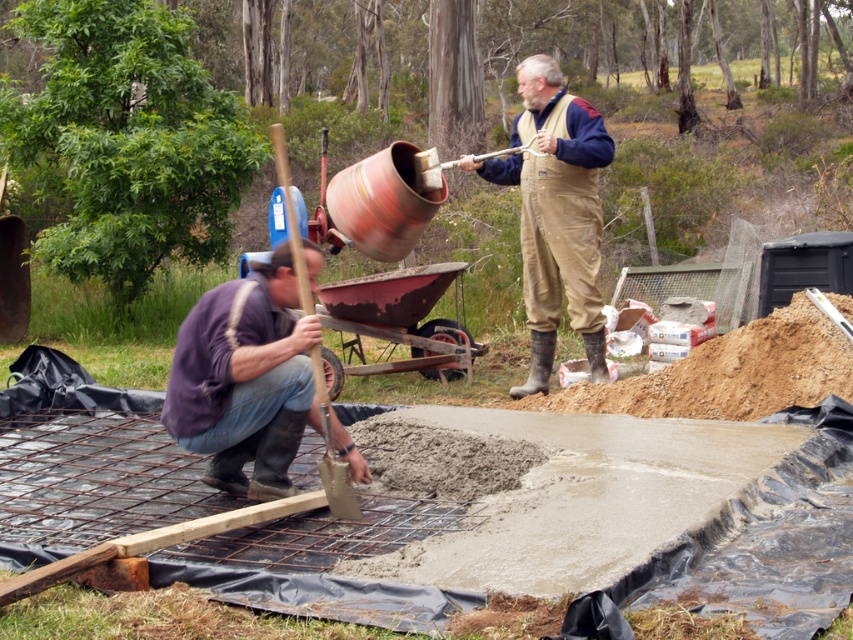
You are standing at the point labeled as point (x=244, y=380) in the image. What color clothing is the person wearing at that location?

The point (x=244, y=380) corresponds to the matte purple shirt at lower left, so the person there is wearing a purple shirt.